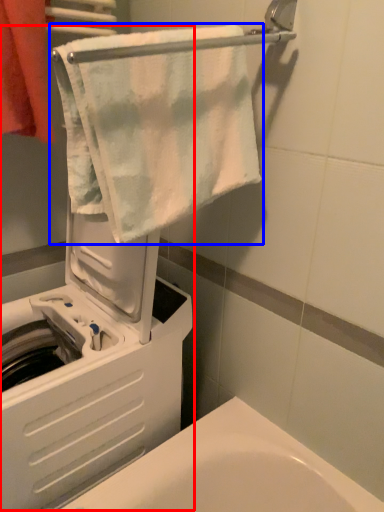
Question: Among these objects, which one is nearest to the camera, machine (highlighted by a red box) or towel (highlighted by a blue box)?

Choices:
 (A) machine
 (B) towel

Answer: (B)